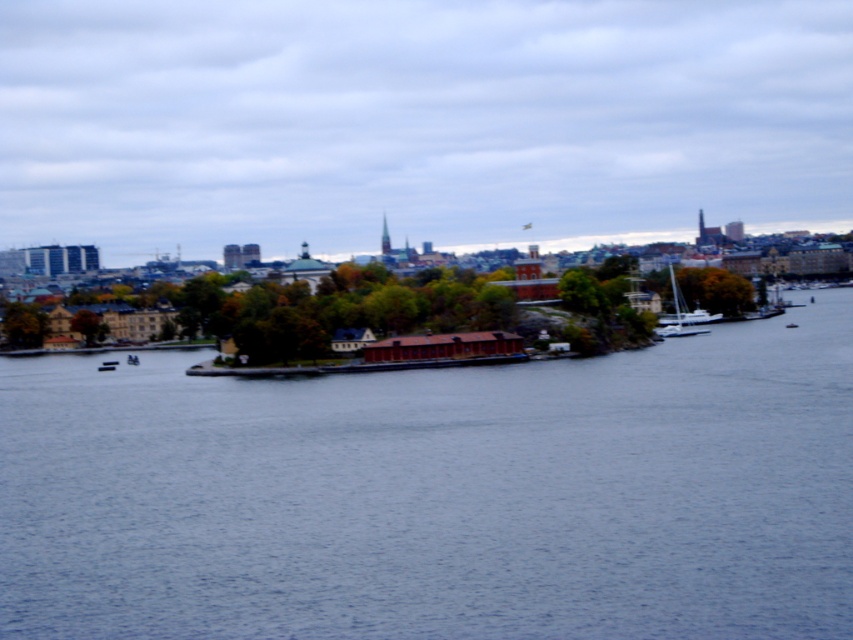
Can you confirm if blue water at center is positioned above green matte tree at center-left?

No.

Is blue water at center below green matte tree at center-left?

Yes.

The height and width of the screenshot is (640, 853). What are the coordinates of `blue water at center` in the screenshot? It's located at (439, 493).

Find the location of a particular element. The width and height of the screenshot is (853, 640). blue water at center is located at coordinates (439, 493).

Does green matte tree at left appear on the left side of white glossy sailboat at right?

Indeed, green matte tree at left is positioned on the left side of white glossy sailboat at right.

What do you see at coordinates (24, 324) in the screenshot? This screenshot has height=640, width=853. I see `green matte tree at left` at bounding box center [24, 324].

Does point (4, 321) come farther from viewer compared to point (657, 333)?

Yes, it is behind point (657, 333).

What are the coordinates of `green matte tree at left` in the screenshot? It's located at (24, 324).

Which is above, green matte tree at left or green matte tree at center-left?

Positioned higher is green matte tree at left.

Which of these two, green matte tree at left or green matte tree at center-left, stands taller?

green matte tree at left is taller.

Find the location of a particular element. The image size is (853, 640). green matte tree at left is located at coordinates (24, 324).

The image size is (853, 640). What are the coordinates of `green matte tree at left` in the screenshot? It's located at (24, 324).